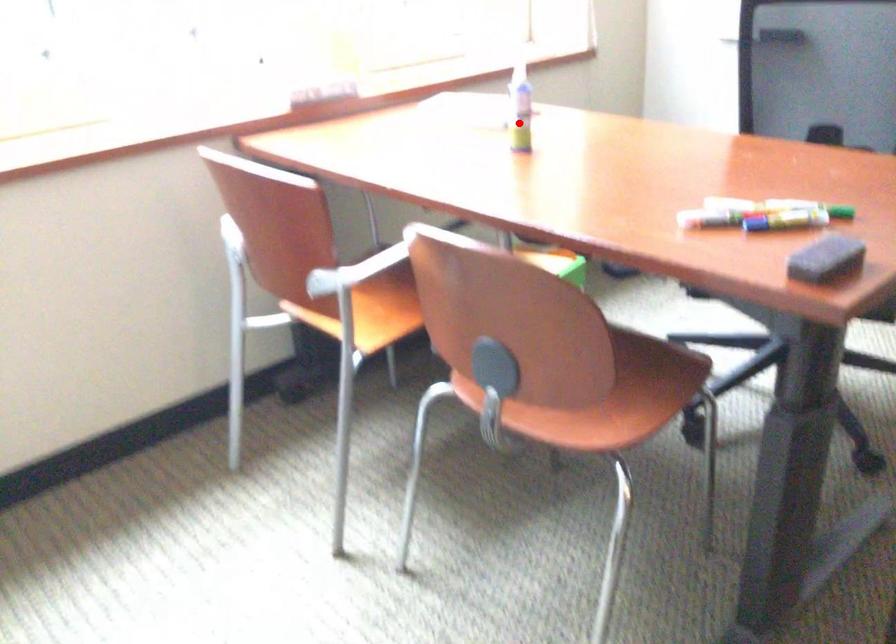
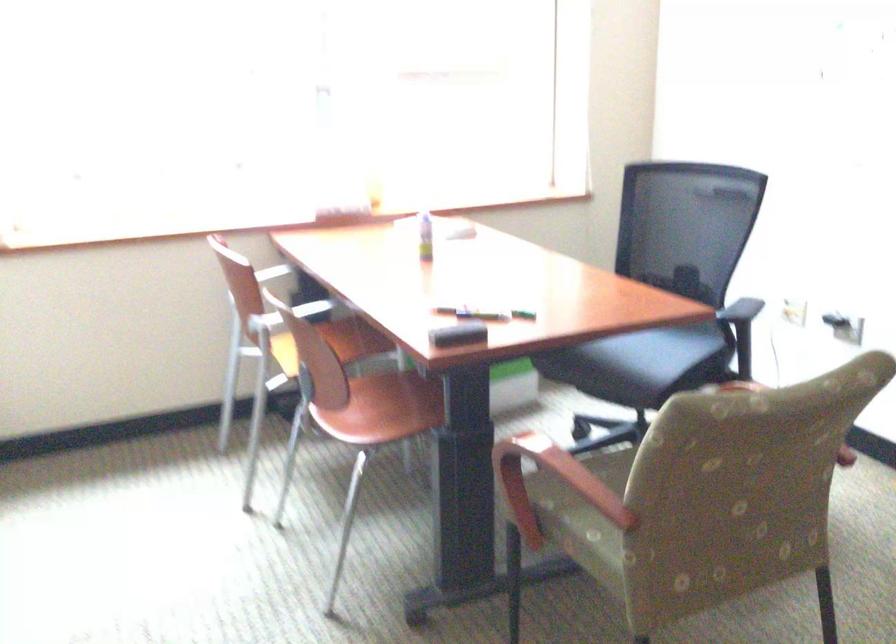
Question: I am providing you with two images of the same scene from different viewpoints. Image1 has a red point marked. In image2, the corresponding 3D location appears at what relative position? Reply with the corresponding letter.

Choices:
 (A) Closer
 (B) Farther

Answer: (B)